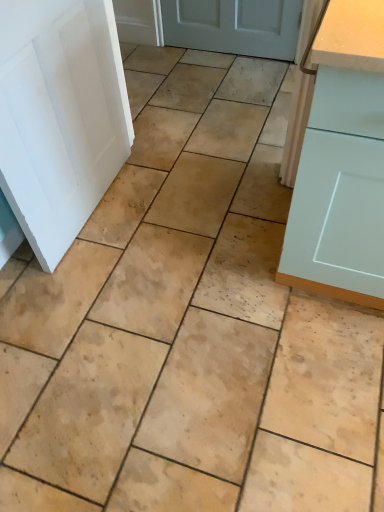
The width and height of the screenshot is (384, 512). Find the location of `vacant area situated below white matte door at left (from a real-world perspective)`. vacant area situated below white matte door at left (from a real-world perspective) is located at coordinates click(x=97, y=206).